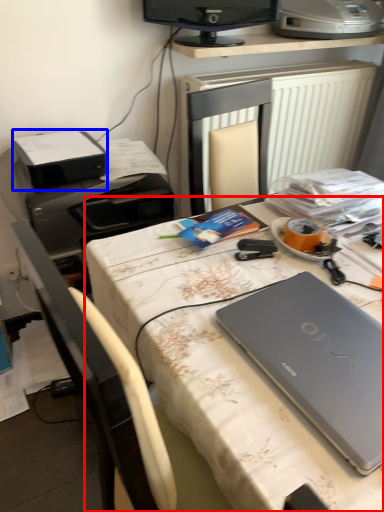
Question: Which of the following is the farthest to the observer, desk (highlighted by a red box) or printer (highlighted by a blue box)?

Choices:
 (A) desk
 (B) printer

Answer: (B)